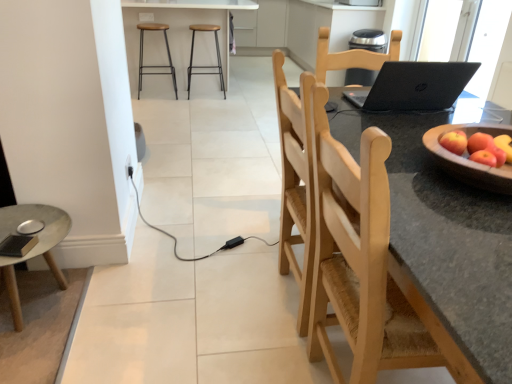
Question: In which direction should I rotate to look at wooden stool at center, acting as the first stool starting from the right?

Choices:
 (A) right
 (B) left

Answer: (B)

Question: Can you confirm if black plastic outlet at lower left is bigger than wooden bowl at right?

Choices:
 (A) yes
 (B) no

Answer: (B)

Question: Is wooden bowl at right a part of black plastic outlet at lower left?

Choices:
 (A) yes
 (B) no

Answer: (B)

Question: Does black plastic outlet at lower left have a smaller size compared to wooden bowl at right?

Choices:
 (A) yes
 (B) no

Answer: (A)

Question: Does black plastic outlet at lower left appear on the left side of wooden bowl at right?

Choices:
 (A) no
 (B) yes

Answer: (B)

Question: Is black plastic outlet at lower left with wooden bowl at right?

Choices:
 (A) no
 (B) yes

Answer: (A)

Question: Is wooden bowl at right at the back of black plastic outlet at lower left?

Choices:
 (A) yes
 (B) no

Answer: (B)

Question: Does red matte apple at right have a greater height compared to wooden bowl at right?

Choices:
 (A) yes
 (B) no

Answer: (B)

Question: Is wooden bowl at right inside red matte apple at right?

Choices:
 (A) no
 (B) yes

Answer: (A)

Question: From a real-world perspective, is red matte apple at right located higher than wooden bowl at right?

Choices:
 (A) no
 (B) yes

Answer: (B)

Question: Is red matte apple at right touching wooden bowl at right?

Choices:
 (A) no
 (B) yes

Answer: (B)

Question: Can you confirm if red matte apple at right is thinner than wooden bowl at right?

Choices:
 (A) no
 (B) yes

Answer: (B)

Question: Does red matte apple at right appear on the left side of wooden bowl at right?

Choices:
 (A) yes
 (B) no

Answer: (A)

Question: Is red matte apple at right turned away from metallic silver barstools at upper center?

Choices:
 (A) no
 (B) yes

Answer: (A)